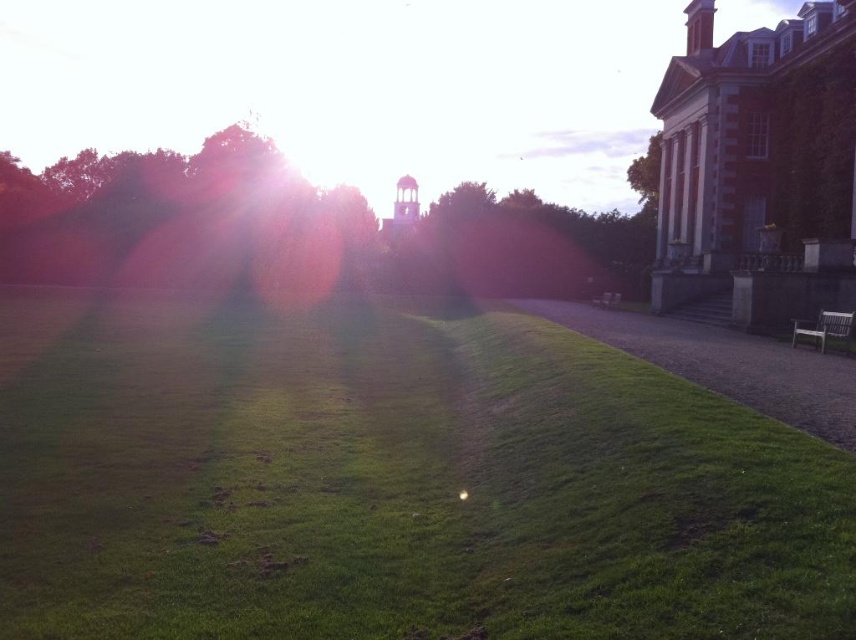
You are a gardener who wants to mow the green grassy at center. Since the metallic silver bench at center is in the way, can you mow the grass without moving the bench?

The green grassy at center is taller than the metallic silver bench at center, so the grass is taller than the bench. Therefore, you can mow the grass without moving the bench because the grass is taller and the bench is lower, allowing the mower to pass over it.

Consider the image. You are standing on the green grassy at center and want to walk to the white wooden bench at right. Which direction should you move to reach it?

To reach the white wooden bench at right from the green grassy at center, you should move to the right since the white wooden bench at right is positioned to the right of the green grassy at center.

You are planning to place a new flower pot that is 1.2 meters wide on the green grassy area at center. Can the green grassy at center accommodate the flower pot without overlapping with the white wooden bench at right?

The green grassy at center has a larger width than the white wooden bench at right. Since the flower pot is 1.2 meters wide, there should be enough space on the green grassy at center to place it without overlapping the bench, provided the positioning is done carefully.